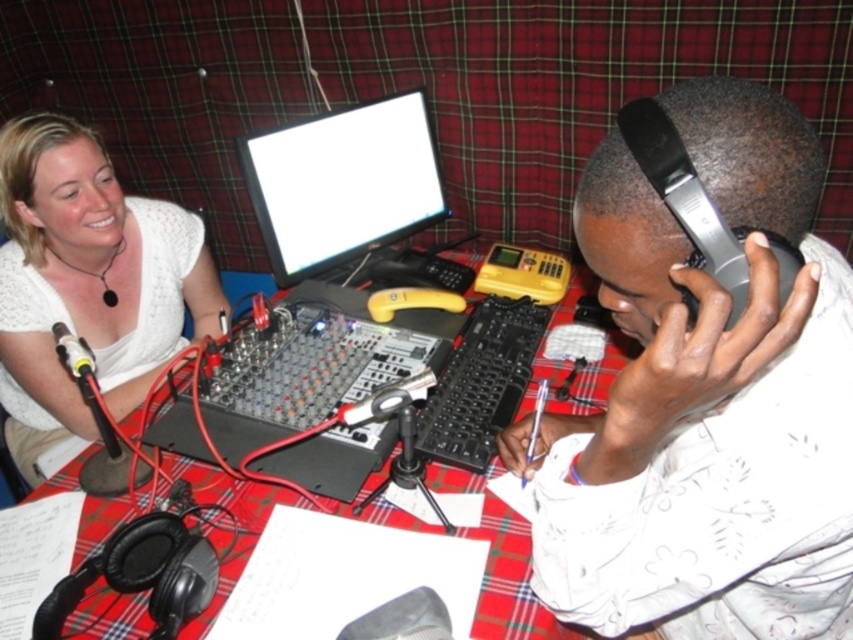
Question: Estimate the real-world distances between objects in this image. Which object is farther from the red plaid table at center?

Choices:
 (A) white glossy computer screen at upper center
 (B) white lace shirt at upper left
 (C) matte black headphones at right

Answer: (A)

Question: Which object is farther from the camera taking this photo?

Choices:
 (A) white glossy computer screen at upper center
 (B) white lace shirt at upper left
 (C) red plaid table at center
 (D) matte black headphones at right

Answer: (B)

Question: From the image, what is the correct spatial relationship of white lace shirt at upper left in relation to red plaid table at center?

Choices:
 (A) right
 (B) left

Answer: (B)

Question: Among these points, which one is nearest to the camera?

Choices:
 (A) (535, 625)
 (B) (743, 163)
 (C) (428, 177)

Answer: (B)

Question: Does matte black headphones at right have a greater width compared to white lace shirt at upper left?

Choices:
 (A) yes
 (B) no

Answer: (B)

Question: Does white glossy computer screen at upper center lie in front of red plaid table at center?

Choices:
 (A) yes
 (B) no

Answer: (B)